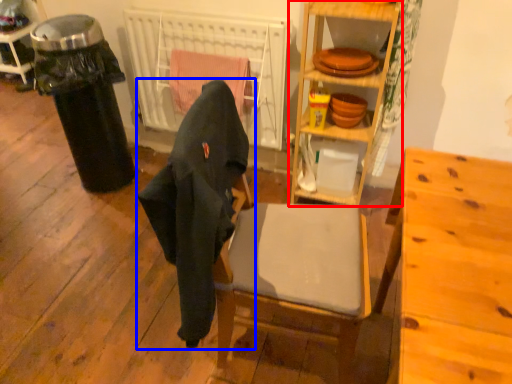
Question: Which of the following is the farthest to the observer, shelf (highlighted by a red box) or chair (highlighted by a blue box)?

Choices:
 (A) shelf
 (B) chair

Answer: (A)